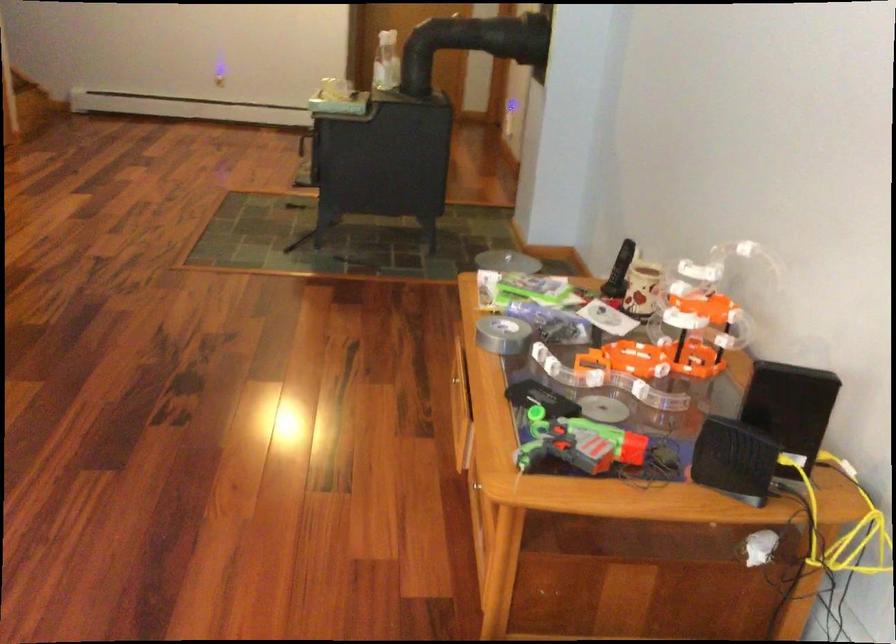
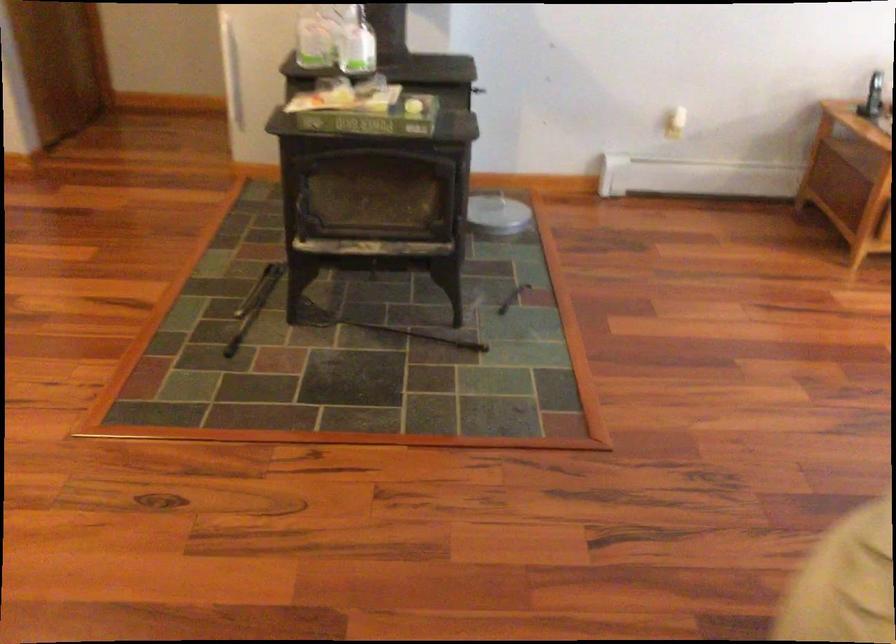
The point at (375, 75) is marked in the first image. Where is the corresponding point in the second image?

(357, 46)